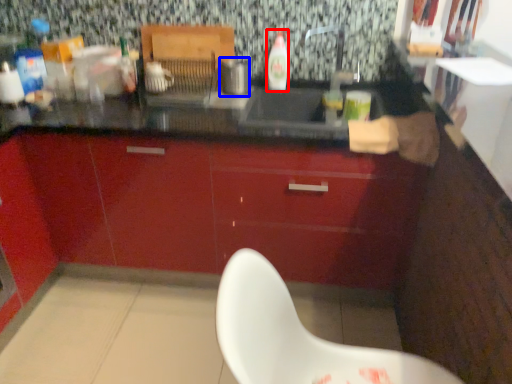
Question: Which point is closer to the camera, bottle (highlighted by a red box) or appliance (highlighted by a blue box)?

Choices:
 (A) bottle
 (B) appliance

Answer: (B)